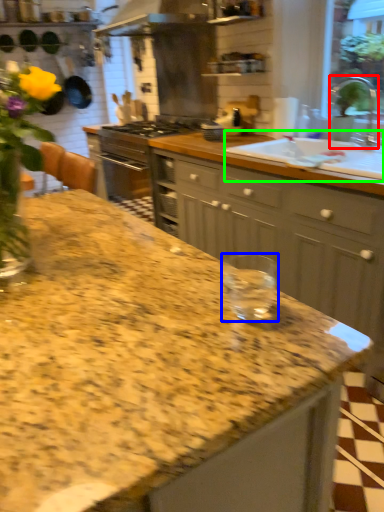
Question: Considering the real-world distances, which object is farthest from faucet (highlighted by a red box)? glass jar (highlighted by a blue box) or sink (highlighted by a green box)?

Choices:
 (A) glass jar
 (B) sink

Answer: (A)